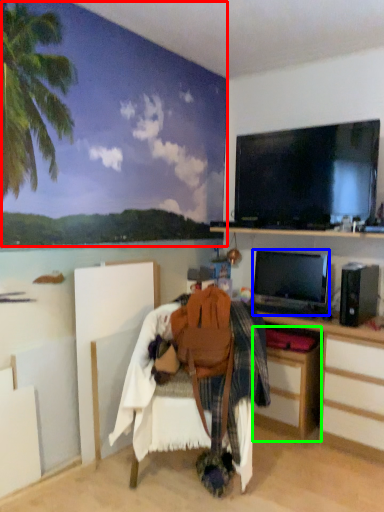
Question: Which object is positioned closest to backdrop (highlighted by a red box)? Select from television (highlighted by a blue box) and cabinetry (highlighted by a green box).

Choices:
 (A) television
 (B) cabinetry

Answer: (A)